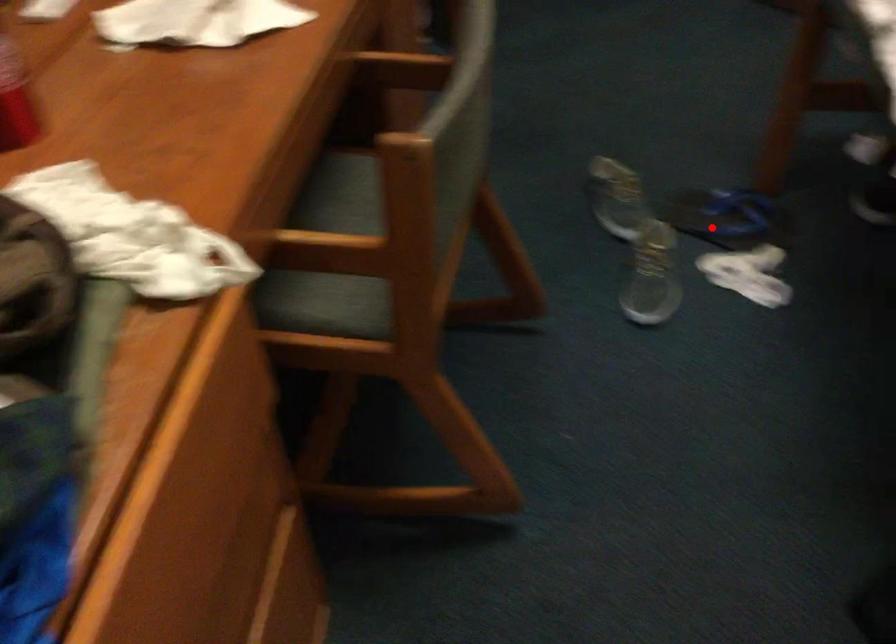
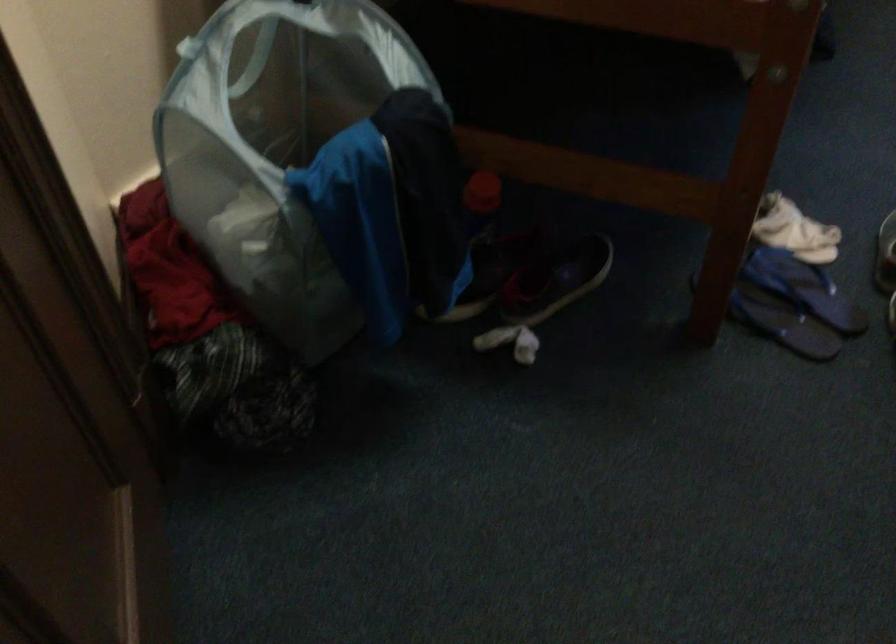
The point at the highlighted location is marked in the first image. Where is the corresponding point in the second image?

(804, 288)